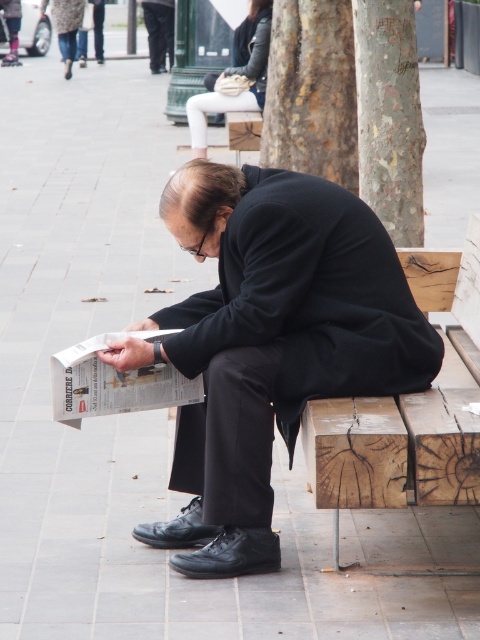
Is wooden bench at lower right positioned before leather jacket at upper center?

Yes, it is in front of leather jacket at upper center.

Does wooden bench at lower right have a smaller size compared to leather jacket at upper center?

Yes.

Is point (448, 572) positioned behind point (251, 88)?

No.

This screenshot has width=480, height=640. In order to click on wooden bench at lower right in this screenshot , I will do `click(408, 417)`.

Consider the image. Who is higher up, leather jacket at upper center or black fabric pants at upper center?

black fabric pants at upper center

Is leather jacket at upper center positioned in front of black fabric pants at upper center?

Yes, it is.

Locate an element on the screen. The image size is (480, 640). leather jacket at upper center is located at coordinates (236, 76).

Who is more distant from viewer, (x=304, y=10) or (x=414, y=120)?

The point (x=304, y=10) is behind.

Is point (354, 177) positioned before point (398, 72)?

No, (354, 177) is behind (398, 72).

At what (x,y) coordinates should I click in order to perform the action: click on smooth bark tree at upper center. Please return your answer as a coordinate pair (x, y). This screenshot has width=480, height=640. Looking at the image, I should click on click(x=312, y=92).

At what (x,y) coordinates should I click in order to perform the action: click on smooth bark tree at upper center. Please return your answer as a coordinate pair (x, y). This screenshot has height=640, width=480. Looking at the image, I should click on (312, 92).